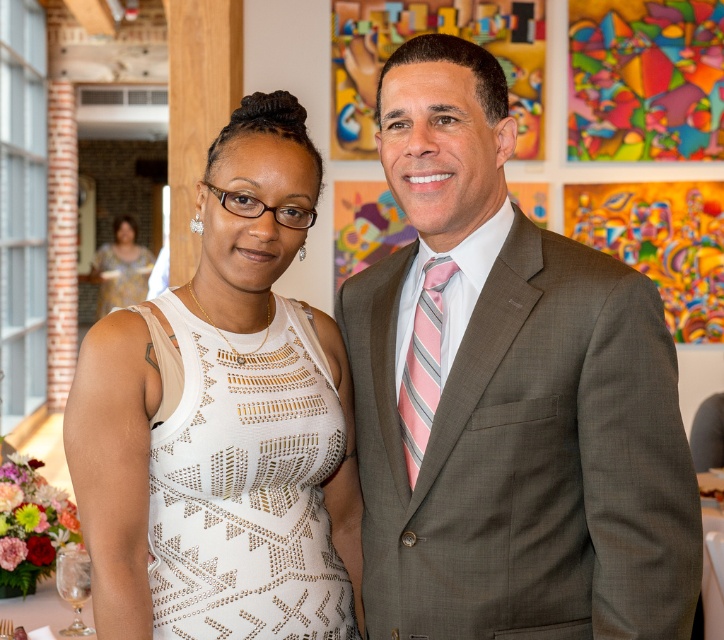
Question: Does gray suit at center have a greater width compared to white textured dress at center?

Choices:
 (A) no
 (B) yes

Answer: (B)

Question: Which point appears closest to the camera in this image?

Choices:
 (A) (463, 541)
 (B) (329, 557)
 (C) (429, 314)
 (D) (98, 253)

Answer: (A)

Question: Does gray suit at center have a lesser width compared to white textured dress at upper left?

Choices:
 (A) yes
 (B) no

Answer: (A)

Question: Which point is closer to the camera taking this photo?

Choices:
 (A) coord(127,280)
 (B) coord(371,632)

Answer: (B)

Question: Can you confirm if gray suit at center is positioned to the left of pink striped tie at center?

Choices:
 (A) yes
 (B) no

Answer: (B)

Question: Which of the following is the farthest from the observer?

Choices:
 (A) pos(605,413)
 (B) pos(420,401)

Answer: (B)